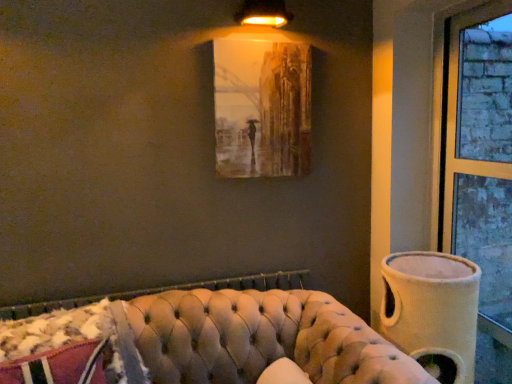
The width and height of the screenshot is (512, 384). Identify the location of matte brown painting at upper center. (262, 108).

At what (x,y) coordinates should I click in order to perform the action: click on beige fabric vase at right. Please return your answer as a coordinate pair (x, y). The height and width of the screenshot is (384, 512). Looking at the image, I should click on [x=432, y=311].

Image resolution: width=512 pixels, height=384 pixels. What are the coordinates of `brick textured window at right` in the screenshot? It's located at (480, 170).

At what (x,y) coordinates should I click in order to perform the action: click on matte gold lampshade at upper center. Please return your answer as a coordinate pair (x, y). Image resolution: width=512 pixels, height=384 pixels. Looking at the image, I should click on (263, 13).

What are the coordinates of `matte brown painting at upper center` in the screenshot? It's located at (262, 108).

Can you confirm if matte brown painting at upper center is taller than brick textured window at right?

In fact, matte brown painting at upper center may be shorter than brick textured window at right.

Does point (254, 169) appear closer or farther from the camera than point (479, 166)?

Point (254, 169).

Between matte brown painting at upper center and brick textured window at right, which one has smaller size?

matte brown painting at upper center is smaller.

From a real-world perspective, which is physically below, matte brown painting at upper center or brick textured window at right?

brick textured window at right.

Is beige fabric vase at right positioned far away from matte brown painting at upper center?

They are positioned close to each other.

Can you tell me how much beige fabric vase at right and matte brown painting at upper center differ in facing direction?

The angle between the facing direction of beige fabric vase at right and the facing direction of matte brown painting at upper center is 4.6 degrees.

Considering the positions of objects beige fabric vase at right and matte brown painting at upper center in the image provided, who is more to the left, beige fabric vase at right or matte brown painting at upper center?

Positioned to the left is matte brown painting at upper center.

Measure the distance from beige fabric vase at right to matte brown painting at upper center.

beige fabric vase at right is 85.79 centimeters away from matte brown painting at upper center.

Can you confirm if matte gold lampshade at upper center is positioned to the right of tufted leather couch at lower center?

Yes.

Consider the image. Does matte gold lampshade at upper center contain tufted leather couch at lower center?

No, tufted leather couch at lower center is not a part of matte gold lampshade at upper center.

Which object is closer to the camera taking this photo, matte gold lampshade at upper center or tufted leather couch at lower center?

tufted leather couch at lower center.

Between matte gold lampshade at upper center and tufted leather couch at lower center, which one has smaller width?

matte gold lampshade at upper center.

Is matte brown painting at upper center facing towards matte gold lampshade at upper center?

No, matte brown painting at upper center is not oriented towards matte gold lampshade at upper center.

Considering the relative positions of matte brown painting at upper center and matte gold lampshade at upper center in the image provided, is matte brown painting at upper center to the left or to the right of matte gold lampshade at upper center?

Based on their positions, matte brown painting at upper center is located to the left of matte gold lampshade at upper center.

At what (x,y) coordinates should I click in order to perform the action: click on lamp in front of the matte brown painting at upper center. Please return your answer as a coordinate pair (x, y). The width and height of the screenshot is (512, 384). Looking at the image, I should click on (263, 13).

Considering the relative sizes of matte brown painting at upper center and matte gold lampshade at upper center in the image provided, is matte brown painting at upper center thinner than matte gold lampshade at upper center?

Correct, the width of matte brown painting at upper center is less than that of matte gold lampshade at upper center.

Relative to matte brown painting at upper center, is tufted leather couch at lower center in front or behind?

In the image, tufted leather couch at lower center appears in front of matte brown painting at upper center.

Consider the image. Would you say matte brown painting at upper center is part of tufted leather couch at lower center's contents?

No, tufted leather couch at lower center does not contain matte brown painting at upper center.

Is tufted leather couch at lower center oriented towards matte brown painting at upper center?

No, tufted leather couch at lower center is not aimed at matte brown painting at upper center.

Are tufted leather couch at lower center and matte brown painting at upper center far apart?

No.

Are beige fabric vase at right and tufted leather couch at lower center beside each other?

No, beige fabric vase at right is not with tufted leather couch at lower center.

Considering the relative sizes of beige fabric vase at right and tufted leather couch at lower center in the image provided, is beige fabric vase at right wider than tufted leather couch at lower center?

No, beige fabric vase at right is not wider than tufted leather couch at lower center.

Considering the relative positions of beige fabric vase at right and tufted leather couch at lower center in the image provided, is beige fabric vase at right to the left or to the right of tufted leather couch at lower center?

beige fabric vase at right is to the right of tufted leather couch at lower center.

Considering the sizes of matte brown painting at upper center and tufted leather couch at lower center in the image, is matte brown painting at upper center bigger or smaller than tufted leather couch at lower center?

matte brown painting at upper center is smaller than tufted leather couch at lower center.

You are a GUI agent. You are given a task and a screenshot of the screen. Output one action in this format:
    pyautogui.click(x=<x>, y=<y>)
    Task: Click on the picture frame located above the tufted leather couch at lower center (from the image's perspective)
    
    Given the screenshot: What is the action you would take?
    pyautogui.click(x=262, y=108)

From a real-world perspective, is matte brown painting at upper center physically below tufted leather couch at lower center?

Incorrect, from a real-world perspective, matte brown painting at upper center is higher than tufted leather couch at lower center.

Identify the location of picture frame on the left of brick textured window at right. (262, 108).

Identify the location of vase on the right of matte brown painting at upper center. (432, 311).

Estimate the real-world distances between objects in this image. Which object is further from matte gold lampshade at upper center, beige fabric vase at right or matte brown painting at upper center?

beige fabric vase at right is further to matte gold lampshade at upper center.

When comparing their distances from tufted leather couch at lower center, does matte brown painting at upper center or brick textured window at right seem closer?

matte brown painting at upper center lies closer to tufted leather couch at lower center than the other object.

Considering their positions, is matte brown painting at upper center positioned closer to brick textured window at right than matte gold lampshade at upper center?

The object closer to brick textured window at right is matte brown painting at upper center.

Looking at the image, which one is located further to tufted leather couch at lower center, beige fabric vase at right or matte brown painting at upper center?

The object further to tufted leather couch at lower center is matte brown painting at upper center.

From the image, which object appears to be nearer to matte brown painting at upper center, beige fabric vase at right or brick textured window at right?

beige fabric vase at right.

From the image, which object appears to be farther from brick textured window at right, beige fabric vase at right or tufted leather couch at lower center?

The object further to brick textured window at right is tufted leather couch at lower center.

Based on their spatial positions, is brick textured window at right or matte gold lampshade at upper center closer to tufted leather couch at lower center?

brick textured window at right is positioned closer to the anchor tufted leather couch at lower center.

Considering their positions, is matte gold lampshade at upper center positioned further to matte brown painting at upper center than brick textured window at right?

Based on the image, brick textured window at right appears to be further to matte brown painting at upper center.

Where is `vase between matte brown painting at upper center and tufted leather couch at lower center vertically`? Image resolution: width=512 pixels, height=384 pixels. vase between matte brown painting at upper center and tufted leather couch at lower center vertically is located at coordinates (432, 311).

Identify the location of window that lies between matte gold lampshade at upper center and tufted leather couch at lower center from top to bottom. The width and height of the screenshot is (512, 384). (480, 170).

In order to click on window between matte brown painting at upper center and beige fabric vase at right in the vertical direction in this screenshot , I will do `click(480, 170)`.

Where is `vase between tufted leather couch at lower center and brick textured window at right`? The image size is (512, 384). vase between tufted leather couch at lower center and brick textured window at right is located at coordinates (432, 311).